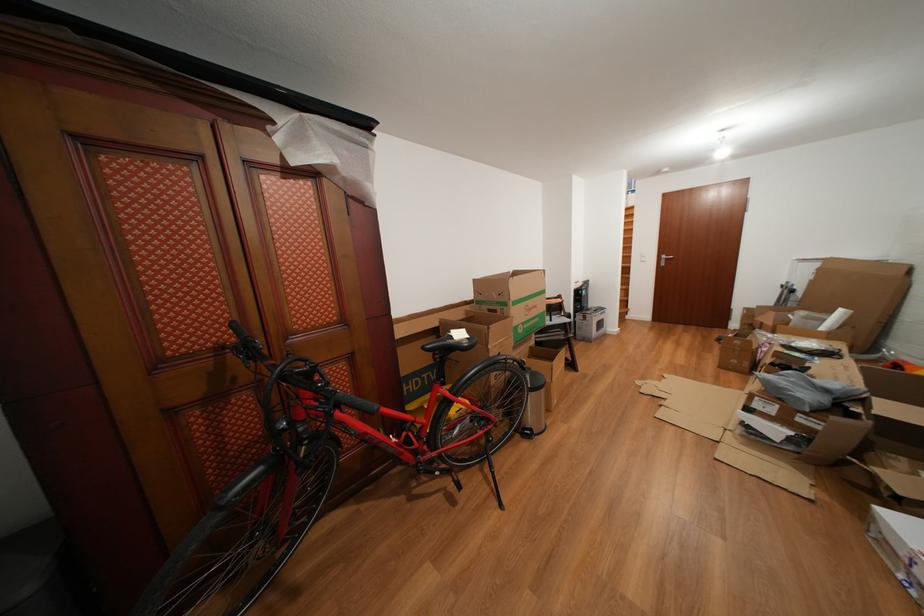
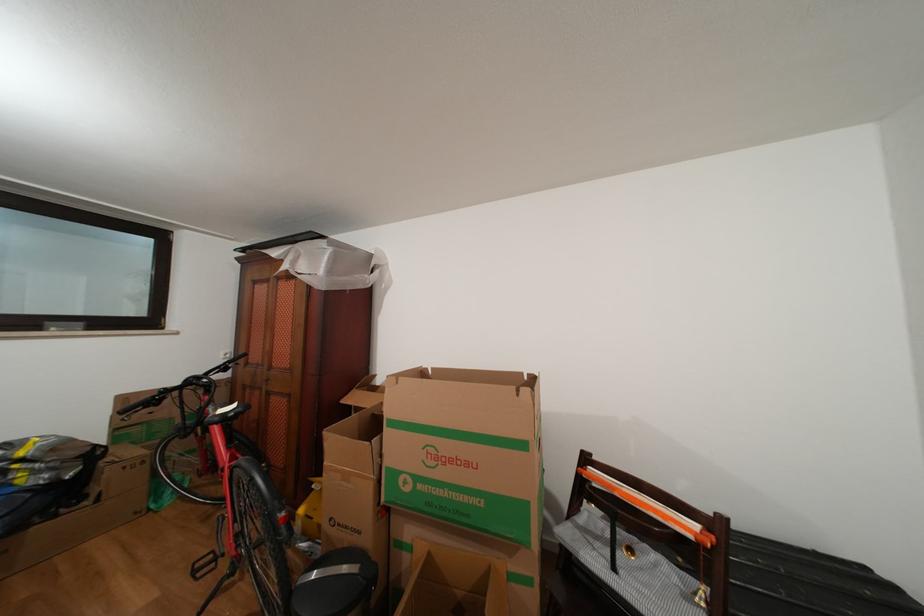
Locate, in the second image, the point that corresponds to (468,339) in the first image.

(237, 413)